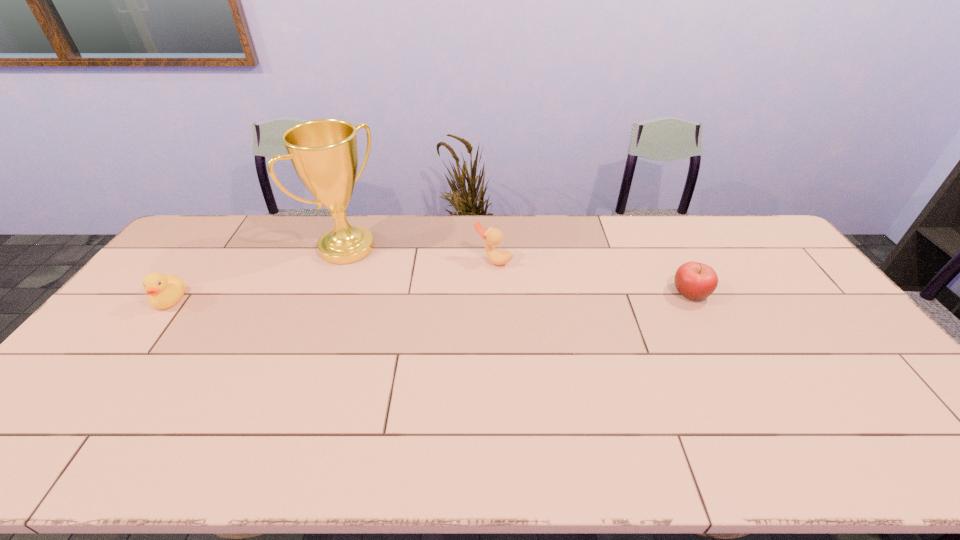
The width and height of the screenshot is (960, 540). Find the location of `duckling`. duckling is located at coordinates (164, 291).

Locate an element on the screen. The height and width of the screenshot is (540, 960). apple is located at coordinates (694, 280).

Identify the location of duck. (492, 236).

Where is `award`? This screenshot has width=960, height=540. award is located at coordinates (324, 153).

Identify the location of the second object from left to right. (324, 153).

You are a GUI agent. You are given a task and a screenshot of the screen. Output one action in this format:
    pyautogui.click(x=<x>, y=<y>)
    Task: Click on the vacant point located on the face of the leftmost object
    This screenshot has width=960, height=540.
    Given the screenshot: What is the action you would take?
    pyautogui.click(x=84, y=414)

Find the location of a particular element. This screenshot has height=540, width=960. free space located on the left of the rightmost object is located at coordinates (565, 293).

This screenshot has width=960, height=540. Identify the location of free space located on the beak of the third object from left to right. (466, 287).

The height and width of the screenshot is (540, 960). Find the location of `vacant space located on the beak of the third object from left to right`. vacant space located on the beak of the third object from left to right is located at coordinates (472, 280).

You are a GUI agent. You are given a task and a screenshot of the screen. Output one action in this format:
    pyautogui.click(x=<x>, y=<y>)
    Task: Click on the vacant space positioned 0.270m on the beak of the third object from left to right
    
    Given the screenshot: What is the action you would take?
    pyautogui.click(x=437, y=319)